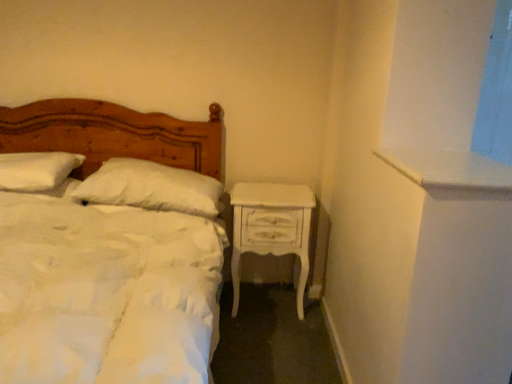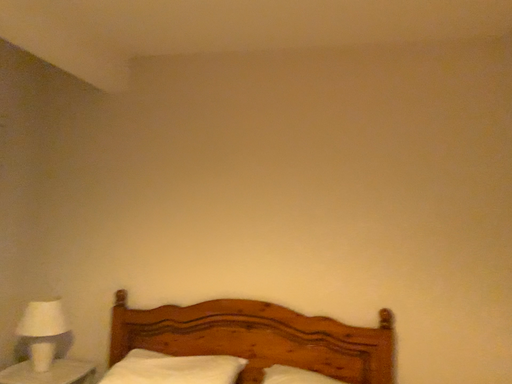
Question: Which way did the camera rotate in the video?

Choices:
 (A) rotated left
 (B) rotated right

Answer: (A)